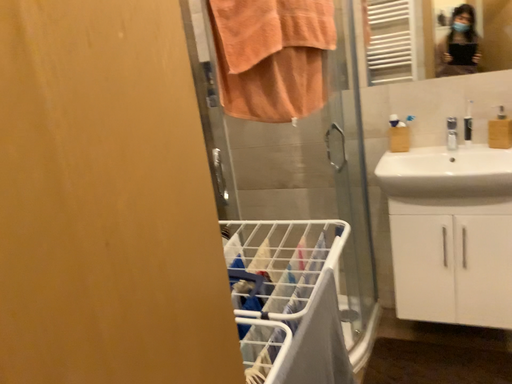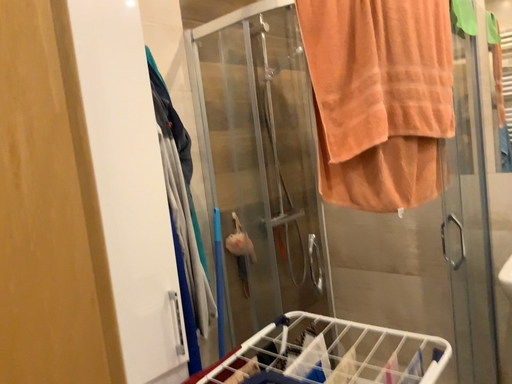
Question: How did the camera likely rotate when shooting the video?

Choices:
 (A) rotated left
 (B) rotated right

Answer: (A)